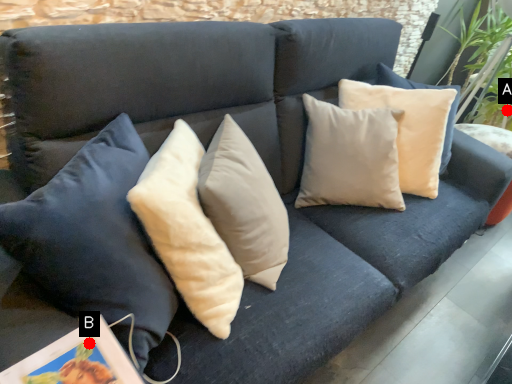
Question: Two points are circled on the image, labeled by A and B beside each circle. Among these points, which one is nearest to the camera?

Choices:
 (A) A is closer
 (B) B is closer

Answer: (B)